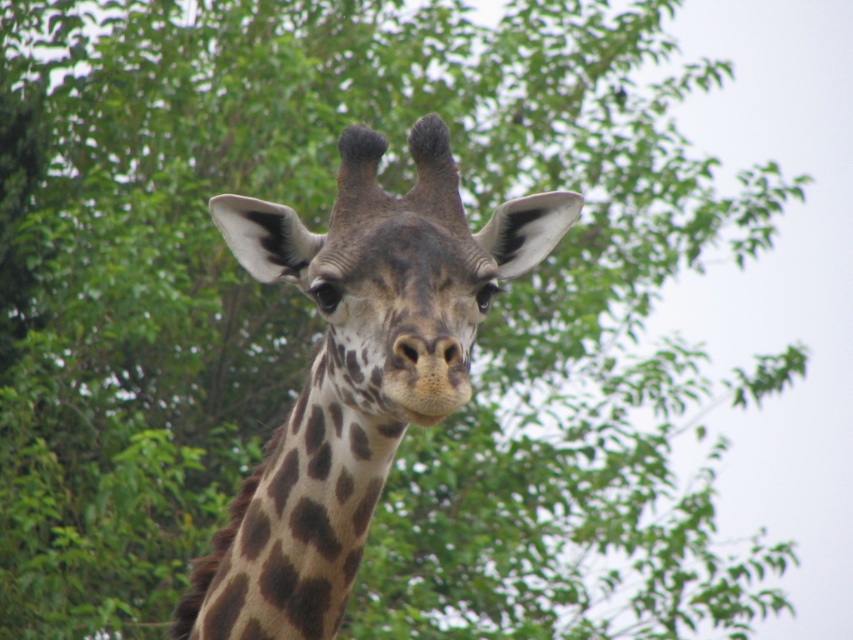
You are a wildlife photographer trying to capture a clear shot of the brown spotted giraffe at center and the brown spotted neck at center. Given that your camera has a focus range of 2 inches, will both subjects be in focus?

The brown spotted giraffe at center is only 2.03 inches away from the brown spotted neck at center, which is just beyond the camera focus range of 2 inches. Therefore, both subjects may not be in focus simultaneously.

You are a wildlife photographer aiming to capture a portrait of the brown spotted giraffe at center. Your camera has a depth of field that can sharply focus on subjects within a 5 feet range. Will the giraffe be in focus?

The brown spotted giraffe at center is 5.85 feet from the camera, which is beyond the 5 feet focus range. Therefore, the giraffe will not be in sharp focus.

You are a wildlife photographer trying to capture a closeup of the brown spotted giraffe at center. Your camera has a focus point at the center of the viewfinder. Will the focus point align with the giraffe?

The brown spotted giraffe at center is positioned at point (355,372), which is slightly off the center of the viewfinder. Therefore, the focus point will not align perfectly with the giraffe.